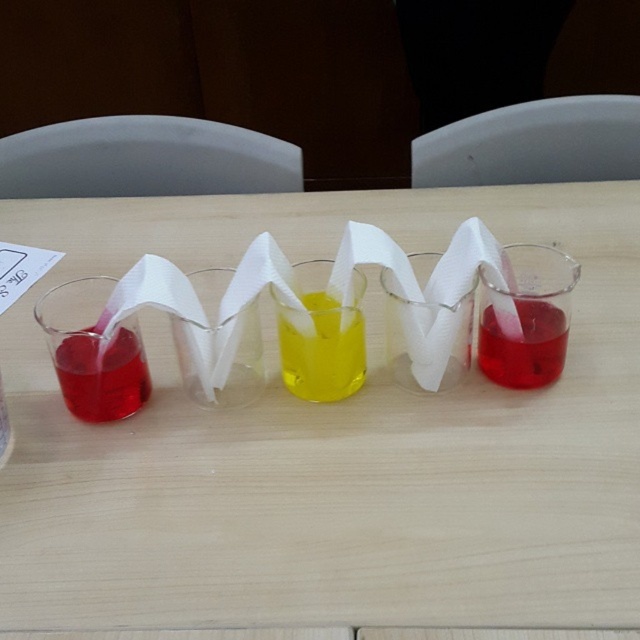
You are standing in front of the table with the transparent glass beakers at center. If you want to reach the beakers without moving your feet, can you estimate how far they are from you?

The transparent glass beakers at center are 47.98 centimeters away from the viewer, so you can comfortably reach them without moving your feet since that distance is within typical arm reach.

You are a student in a chemistry lab and need to pour the yellow translucent liquid at center into the matte plastic beaker at left. Based on the scene, will the beaker be able to hold all the liquid without spilling?

The yellow translucent liquid at center has a greater width than the matte plastic beaker at left, so pouring it into the beaker may cause overflow and spillage. The beaker might not hold all the liquid.

You are standing in front of the table with the beakers and want to reach for the two points marked on the table. Which point, point [314,387] or point [129,385], is closer to your hand?

Point [314,387] is further to the camera than point [129,385], so the point closer to your hand is point [129,385].